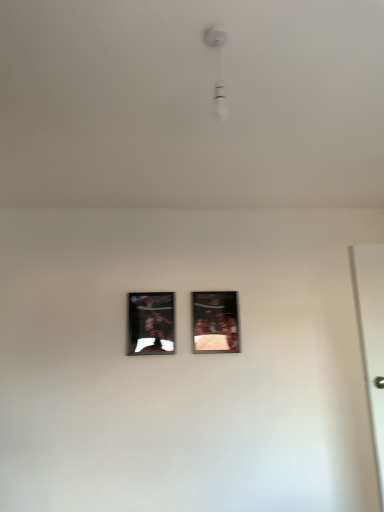
Question: Can you confirm if metallic silver picture frame at center, which appears as the second picture frame when viewed from the left, is taller than white glossy bulb at upper center?

Choices:
 (A) yes
 (B) no

Answer: (A)

Question: Considering the relative positions of metallic silver picture frame at center, which appears as the second picture frame when viewed from the left, and white glossy bulb at upper center in the image provided, is metallic silver picture frame at center, which appears as the second picture frame when viewed from the left, to the right of white glossy bulb at upper center from the viewer's perspective?

Choices:
 (A) yes
 (B) no

Answer: (A)

Question: Could you tell me if metallic silver picture frame at center, which is counted as the 1th picture frame, starting from the right, is facing white glossy bulb at upper center?

Choices:
 (A) no
 (B) yes

Answer: (B)

Question: From a real-world perspective, is metallic silver picture frame at center, which is counted as the 1th picture frame, starting from the right, positioned under white glossy bulb at upper center based on gravity?

Choices:
 (A) no
 (B) yes

Answer: (B)

Question: Is metallic silver picture frame at center, which is counted as the 1th picture frame, starting from the right, closer to the viewer compared to white glossy bulb at upper center?

Choices:
 (A) yes
 (B) no

Answer: (B)

Question: Is metallic reflective frame at center, the 1th picture frame when ordered from left to right, wider or thinner than white glossy bulb at upper center?

Choices:
 (A) wide
 (B) thin

Answer: (B)

Question: From a real-world perspective, relative to white glossy bulb at upper center, is metallic reflective frame at center, which is counted as the second picture frame, starting from the right, vertically above or below?

Choices:
 (A) below
 (B) above

Answer: (A)

Question: Considering the positions of metallic reflective frame at center, which is counted as the second picture frame, starting from the right, and white glossy bulb at upper center in the image, is metallic reflective frame at center, which is counted as the second picture frame, starting from the right, taller or shorter than white glossy bulb at upper center?

Choices:
 (A) tall
 (B) short

Answer: (A)

Question: Does point (160, 320) appear closer or farther from the camera than point (223, 95)?

Choices:
 (A) farther
 (B) closer

Answer: (A)

Question: Based on their positions, is metallic reflective frame at center, which is counted as the second picture frame, starting from the right, located to the left or right of metallic silver picture frame at center, which appears as the second picture frame when viewed from the left?

Choices:
 (A) left
 (B) right

Answer: (A)

Question: Is metallic reflective frame at center, the 1th picture frame when ordered from left to right, inside or outside of metallic silver picture frame at center, which is counted as the 1th picture frame, starting from the right?

Choices:
 (A) inside
 (B) outside

Answer: (B)

Question: From a real-world perspective, is metallic reflective frame at center, the 1th picture frame when ordered from left to right, positioned above or below metallic silver picture frame at center, which is counted as the 1th picture frame, starting from the right?

Choices:
 (A) below
 (B) above

Answer: (A)

Question: Is point coord(144,328) positioned closer to the camera than point coord(210,318)?

Choices:
 (A) closer
 (B) farther

Answer: (A)

Question: Relative to metallic silver picture frame at center, which is counted as the 1th picture frame, starting from the right, is white glossy bulb at upper center in front or behind?

Choices:
 (A) behind
 (B) front

Answer: (B)

Question: From the image's perspective, is white glossy bulb at upper center positioned above or below metallic silver picture frame at center, which is counted as the 1th picture frame, starting from the right?

Choices:
 (A) below
 (B) above

Answer: (B)